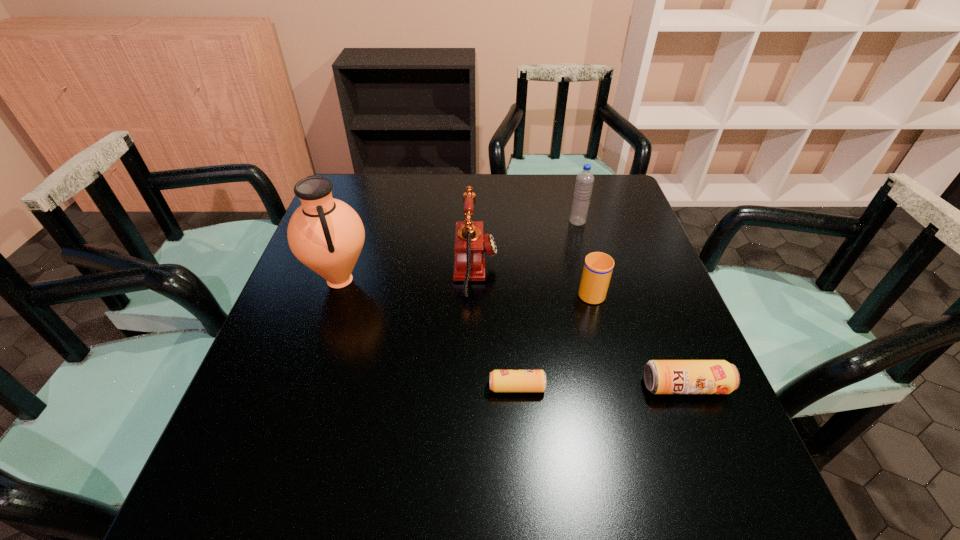
This screenshot has height=540, width=960. Identify the location of free space located on the front of the fifth tallest object. (710, 451).

The width and height of the screenshot is (960, 540). Identify the location of vacant space located on the side of the cup with the handle. (565, 196).

You are a GUI agent. You are given a task and a screenshot of the screen. Output one action in this format:
    pyautogui.click(x=<x>, y=<y>)
    Task: Click on the vacant region located on the side of the cup with the handle
    The image size is (960, 540).
    Given the screenshot: What is the action you would take?
    pyautogui.click(x=573, y=224)

Identify the location of free spot located 0.120m on the side of the cup with the handle. Image resolution: width=960 pixels, height=540 pixels. (580, 248).

What are the coordinates of `vacant space situated 0.140m on the right of the tallest object` in the screenshot? It's located at (429, 280).

You are a GUI agent. You are given a task and a screenshot of the screen. Output one action in this format:
    pyautogui.click(x=<x>, y=<y>)
    Task: Click on the free space located 0.070m on the front of the water bottle
    The height and width of the screenshot is (540, 960).
    Given the screenshot: What is the action you would take?
    pyautogui.click(x=583, y=242)

Identify the location of free spot located on the dial of the telephone. The width and height of the screenshot is (960, 540). (551, 269).

Find the location of `object present at the left edge`. object present at the left edge is located at coordinates coord(327,235).

Identify the location of beer can situated at the right edge. (660, 376).

Locate an element on the screen. cup located in the right edge section of the desktop is located at coordinates (598, 267).